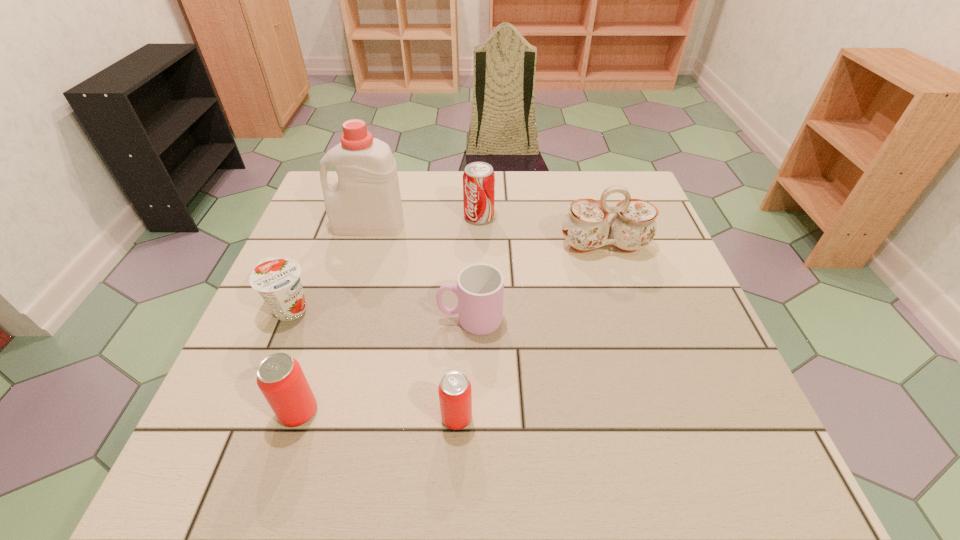
You are a GUI agent. You are given a task and a screenshot of the screen. Output one action in this format:
    pyautogui.click(x=<x>, y=<y>)
    Task: Click on the taller beer can
    
    Given the screenshot: What is the action you would take?
    280,378

What are the coordinates of `the right beer can` in the screenshot? It's located at (455, 396).

Locate an element on the screen. This screenshot has width=960, height=540. chinaware is located at coordinates (586, 226).

The image size is (960, 540). I want to click on the tallest object, so click(366, 201).

At what (x,y) coordinates should I click in order to perform the action: click on soda can. Please return your answer as a coordinate pair (x, y). The image size is (960, 540). Looking at the image, I should click on (478, 178).

Where is `cup`? Image resolution: width=960 pixels, height=540 pixels. cup is located at coordinates (480, 287).

Where is `yogurt`? This screenshot has width=960, height=540. yogurt is located at coordinates (277, 280).

The image size is (960, 540). Find the location of `free space located on the back of the taller beer can`. free space located on the back of the taller beer can is located at coordinates (346, 266).

Identify the location of free space located 0.140m on the right of the shorter beer can. (552, 417).

You are a GUI agent. You are given a task and a screenshot of the screen. Output one action in this format:
    pyautogui.click(x=<x>, y=<y>)
    Task: Click on the free spot located by the handle of the rightmost object
    The width and height of the screenshot is (960, 540).
    Given the screenshot: What is the action you would take?
    (636, 347)